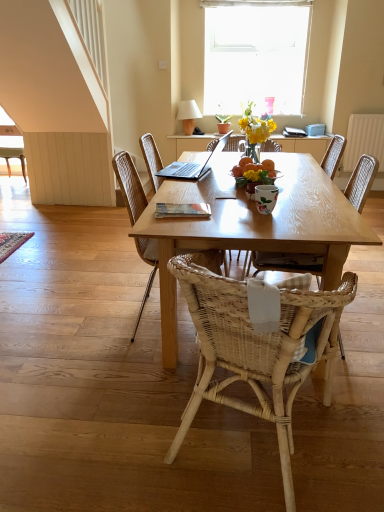
In order to click on vacant space that is to the left of white glossy coffee cup at center in this screenshot , I will do `click(238, 210)`.